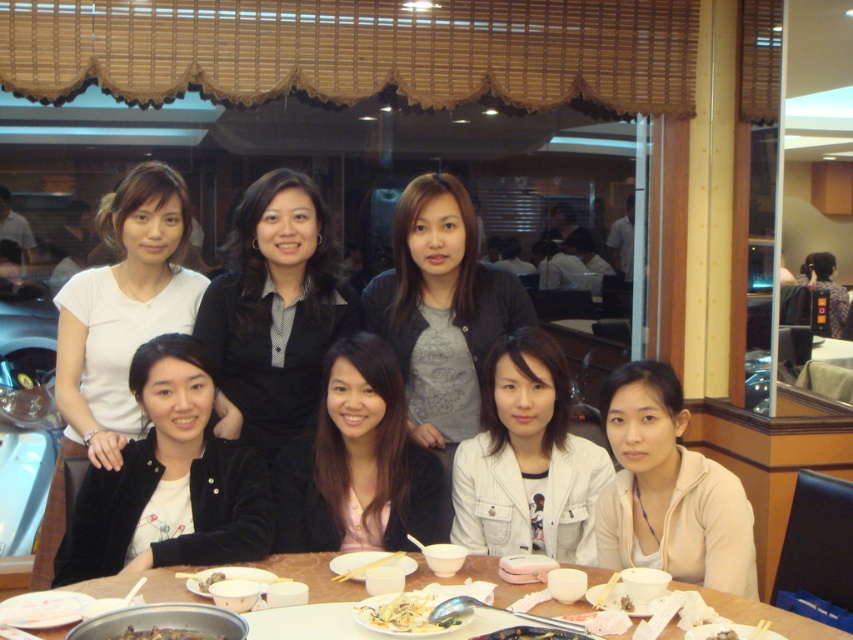
You are a photographer adjusting the camera height to ensure both the velvet black jacket at lower left and the white matte jacket at lower right are fully visible in the frame. Given their height difference, which jacket requires you to position the camera higher to capture its full length?

The velvet black jacket at lower left is much taller than the white matte jacket at lower right, so to capture its full length, the camera should be positioned higher to account for its greater height.

In the scene shown: You are a photographer standing in front of the velvet black jacket at lower left and the wooden table at center. You want to take a photo of the group without any obstructions. Which object should you move to ensure the group is fully visible?

The wooden table at center is behind the velvet black jacket at lower left. To ensure the group is fully visible, you should move the velvet black jacket at lower left out of the way since it is in front of the table and blocking the view.